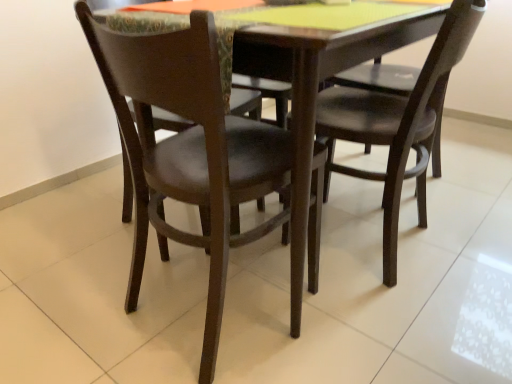
What are the coordinates of `vacant area that is situated to the right of matte black chair at center, which ranks as the second chair in left-to-right order` in the screenshot? It's located at (472, 237).